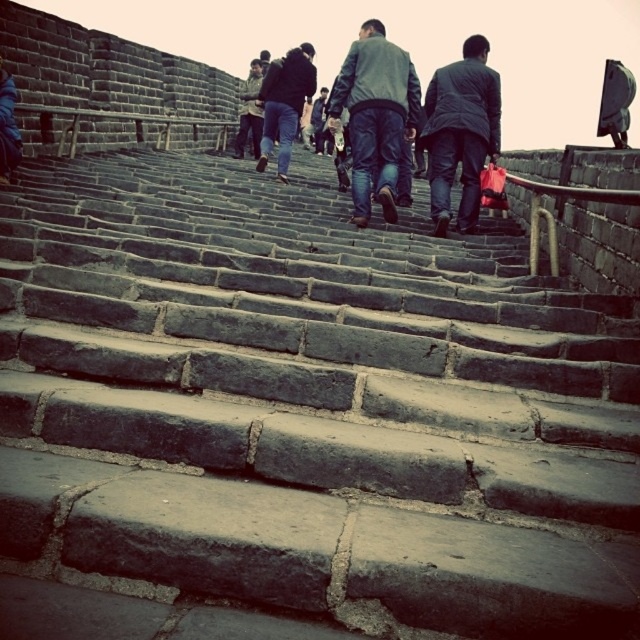
You are standing at the bottom of the Great Wall staircase and see the point marked at coordinates (376, 115). What object is located at that point?

The point marked at coordinates (376, 115) is the location of the dark gray jacket at center.

You are a photographer trying to capture a photo of the dark gray jacket at center and dark blue jeans at center from this angle. Which of the two items will appear narrower in your photo?

The dark gray jacket at center is thinner than dark blue jeans at center, so the dark gray jacket at center will appear narrower in the photo.

You are standing at the base of the Great Wall and see a group of people climbing the stairs. There is a person wearing a dark gray fabric jacket at center. Where is this person located relative to the point marked as point (460, 132)?

The point (460, 132) indicates the dark gray fabric jacket at center, so the person is exactly at that point.